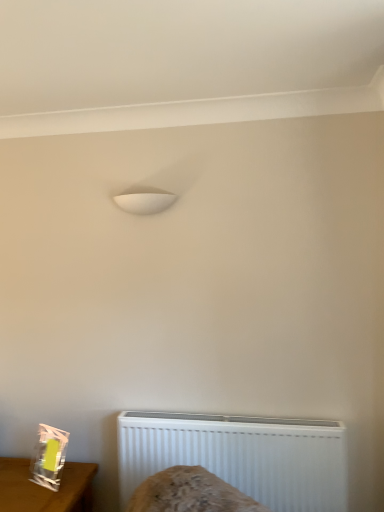
Question: Is white plastic radiator at lower center aimed at clear plastic bag at lower left?

Choices:
 (A) yes
 (B) no

Answer: (B)

Question: Is white plastic radiator at lower center further to the viewer compared to clear plastic bag at lower left?

Choices:
 (A) yes
 (B) no

Answer: (A)

Question: From the image's perspective, is white plastic radiator at lower center located above clear plastic bag at lower left?

Choices:
 (A) no
 (B) yes

Answer: (B)

Question: Is clear plastic bag at lower left completely or partially inside white plastic radiator at lower center?

Choices:
 (A) yes
 (B) no

Answer: (B)

Question: Does white plastic radiator at lower center have a larger size compared to clear plastic bag at lower left?

Choices:
 (A) yes
 (B) no

Answer: (B)

Question: Does white plastic radiator at lower center lie in front of clear plastic bag at lower left?

Choices:
 (A) no
 (B) yes

Answer: (A)

Question: Is clear plastic bag at lower left further to camera compared to white plastic radiator at lower center?

Choices:
 (A) yes
 (B) no

Answer: (B)

Question: Considering the relative sizes of clear plastic bag at lower left and white plastic radiator at lower center in the image provided, is clear plastic bag at lower left smaller than white plastic radiator at lower center?

Choices:
 (A) no
 (B) yes

Answer: (A)

Question: Is clear plastic bag at lower left directly adjacent to white plastic radiator at lower center?

Choices:
 (A) yes
 (B) no

Answer: (B)

Question: Are clear plastic bag at lower left and white plastic radiator at lower center far apart?

Choices:
 (A) yes
 (B) no

Answer: (B)

Question: Is clear plastic bag at lower left facing towards white plastic radiator at lower center?

Choices:
 (A) yes
 (B) no

Answer: (B)

Question: Is the depth of clear plastic bag at lower left less than that of white plastic radiator at lower center?

Choices:
 (A) yes
 (B) no

Answer: (A)

Question: From the image's perspective, is white plastic radiator at lower center positioned above or below clear plastic bag at lower left?

Choices:
 (A) below
 (B) above

Answer: (B)